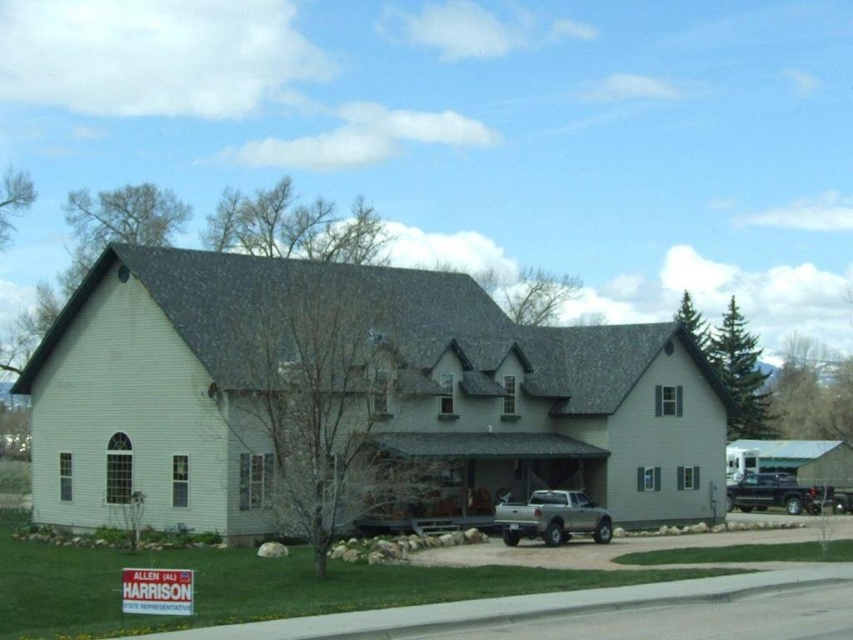
Question: Where is silver metallic truck at lower center located in relation to shiny black truck at lower right in the image?

Choices:
 (A) below
 (B) above

Answer: (B)

Question: Among these points, which one is farthest from the camera?

Choices:
 (A) (741, 508)
 (B) (503, 544)

Answer: (A)

Question: From the image, what is the correct spatial relationship of silver metallic truck at lower center in relation to shiny black truck at lower right?

Choices:
 (A) above
 (B) below

Answer: (A)

Question: In this image, where is silver metallic truck at lower center located relative to shiny black truck at lower right?

Choices:
 (A) left
 (B) right

Answer: (A)

Question: Among these objects, which one is nearest to the camera?

Choices:
 (A) silver metallic truck at lower center
 (B) shiny black truck at lower right

Answer: (A)